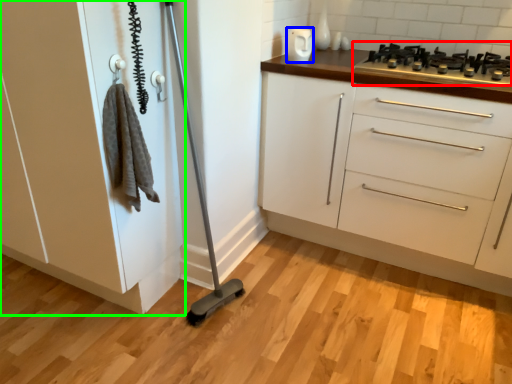
Question: Estimate the real-world distances between objects in this image. Which object is farther from gas stove (highlighted by a red box), appliance (highlighted by a blue box) or cabinetry (highlighted by a green box)?

Choices:
 (A) appliance
 (B) cabinetry

Answer: (B)